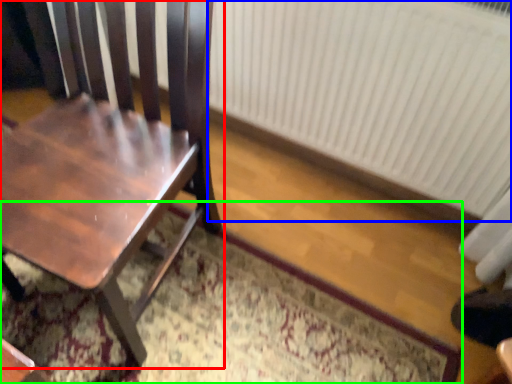
Question: Considering the real-world distances, which object is farthest from chair (highlighted by a red box)? radiator (highlighted by a blue box) or doormat (highlighted by a green box)?

Choices:
 (A) radiator
 (B) doormat

Answer: (A)